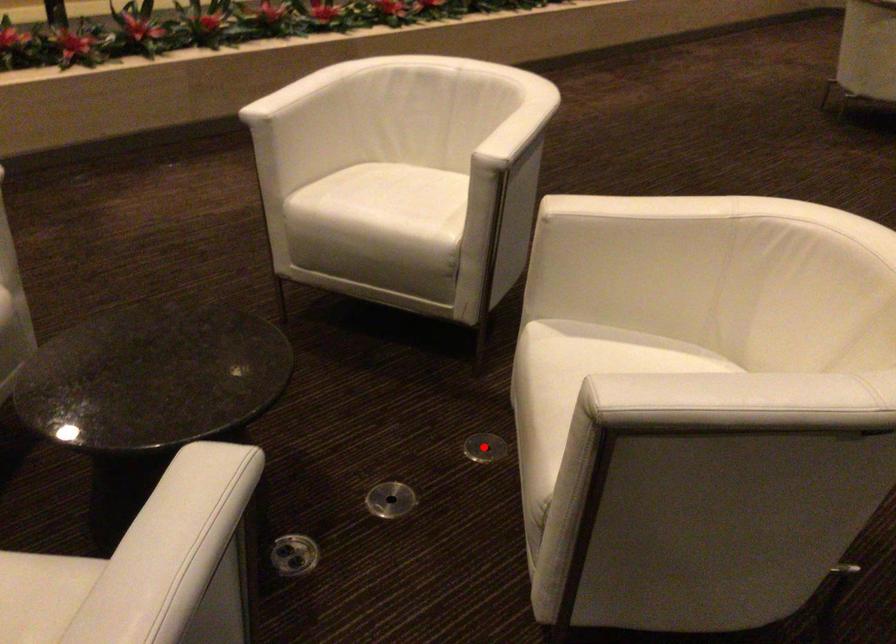
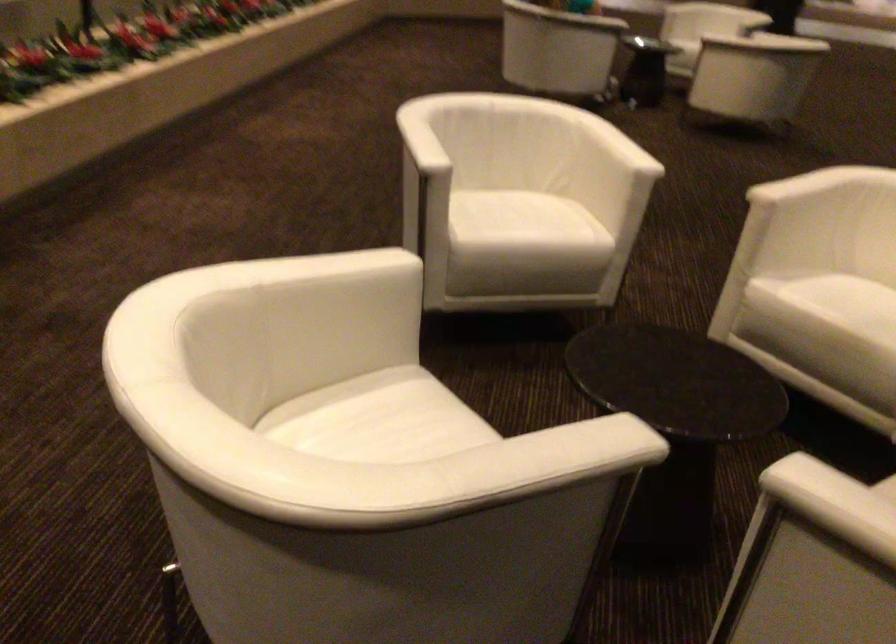
Question: I am providing you with two images of the same scene from different viewpoints. A red point is marked on the first image. Is the red point's position out of view in image 2?

Choices:
 (A) Yes
 (B) No

Answer: (A)